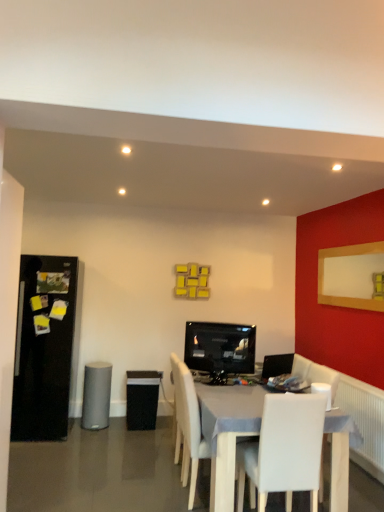
This screenshot has width=384, height=512. I want to click on vacant area that is situated to the right of black glossy refrigerator at left, so click(105, 439).